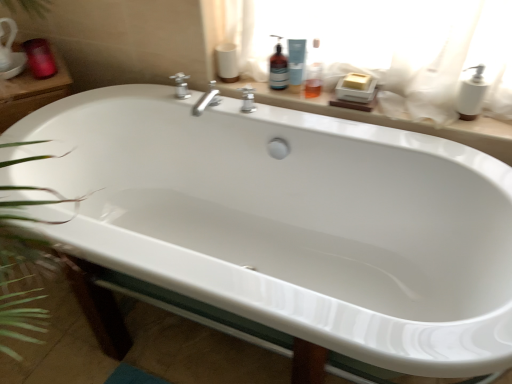
This screenshot has width=512, height=384. What are the coordinates of `vacant area to the left of blue plastic bottle at upper center, the first cleaning product in the right-to-left sequence` in the screenshot? It's located at (259, 93).